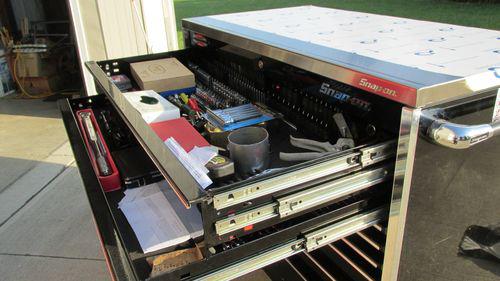
At what (x,y) coordinates should I click in order to perform the action: click on drawers. Please return your answer as a coordinate pair (x, y). This screenshot has width=500, height=281. Looking at the image, I should click on (245, 193), (222, 266).